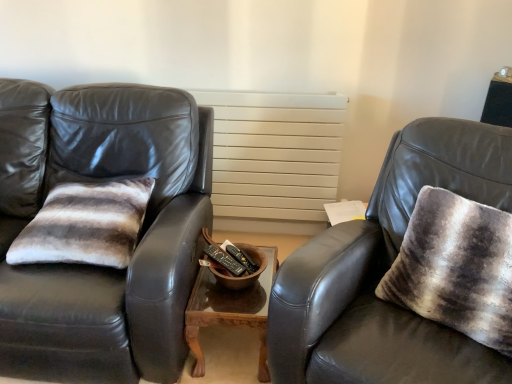
Question: Does matte black leather chair at right have a lesser height compared to textured gray throw pillow at right?

Choices:
 (A) yes
 (B) no

Answer: (B)

Question: From the image's perspective, is matte black leather chair at right on top of textured gray throw pillow at right?

Choices:
 (A) yes
 (B) no

Answer: (B)

Question: From the image's perspective, is matte black leather chair at right under textured gray throw pillow at right?

Choices:
 (A) yes
 (B) no

Answer: (A)

Question: Is matte black leather chair at right facing towards textured gray throw pillow at right?

Choices:
 (A) yes
 (B) no

Answer: (A)

Question: Can you see matte black leather chair at right touching textured gray throw pillow at right?

Choices:
 (A) no
 (B) yes

Answer: (A)

Question: Is matte black leather chair at right in front of or behind textured gray throw pillow at right in the image?

Choices:
 (A) front
 (B) behind

Answer: (A)

Question: Is point (488, 177) closer or farther from the camera than point (508, 258)?

Choices:
 (A) farther
 (B) closer

Answer: (A)

Question: From a real-world perspective, is matte black leather chair at right positioned above or below textured gray throw pillow at right?

Choices:
 (A) below
 (B) above

Answer: (A)

Question: Is matte black leather chair at right taller or shorter than textured gray throw pillow at right?

Choices:
 (A) tall
 (B) short

Answer: (A)

Question: Is striped fur pillow at left taller or shorter than wooden table at center?

Choices:
 (A) tall
 (B) short

Answer: (B)

Question: Considering the relative positions of striped fur pillow at left and wooden table at center in the image provided, is striped fur pillow at left to the left or to the right of wooden table at center?

Choices:
 (A) right
 (B) left

Answer: (B)

Question: Would you say striped fur pillow at left is inside or outside wooden table at center?

Choices:
 (A) outside
 (B) inside

Answer: (A)

Question: Considering their positions, is striped fur pillow at left located in front of or behind wooden table at center?

Choices:
 (A) front
 (B) behind

Answer: (A)

Question: Is point (287, 157) closer or farther from the camera than point (27, 112)?

Choices:
 (A) farther
 (B) closer

Answer: (A)

Question: In the image, is white matte radiator at center on the left side or the right side of matte black leather couch at left?

Choices:
 (A) right
 (B) left

Answer: (A)